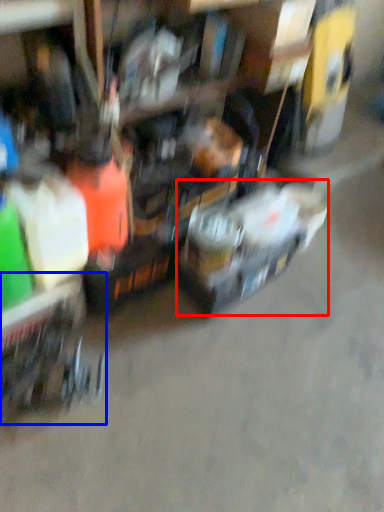
Question: Among these objects, which one is farthest to the camera, vehicle (highlighted by a red box) or trolley (highlighted by a blue box)?

Choices:
 (A) vehicle
 (B) trolley

Answer: (A)